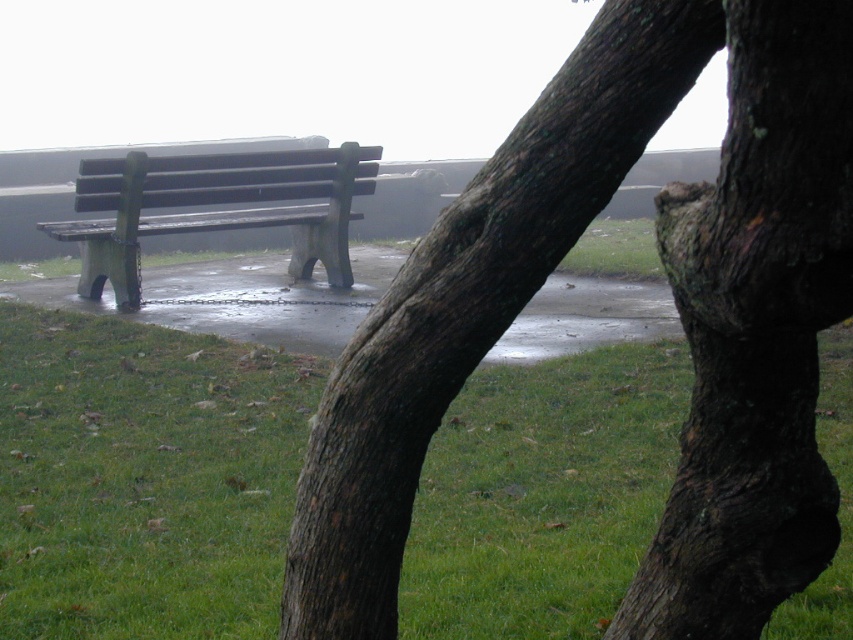
You are standing in the park and want to touch the dark brown textured bark at center. Based on the coordinates provided, in which direction should you move relative to the bench to reach it?

The dark brown textured bark at center is located at coordinates point (674, 301). Since the bench is at the lower part of the image, moving towards the center area would mean moving forward towards the center of the park area where the bark is situated.

You are a park visitor who wants to sit on the wooden bench at left. There is a dark brown textured bark at center blocking your path. Can you walk around it easily?

The dark brown textured bark at center is shorter than wooden bench at left, so you can walk around it easily since it is lower in height.

You are a gardener who needs to mow the lawn. You see the green grass at lower center and the wooden bench at left. Which object is shorter?

The green grass at lower center is shorter than the wooden bench at left.